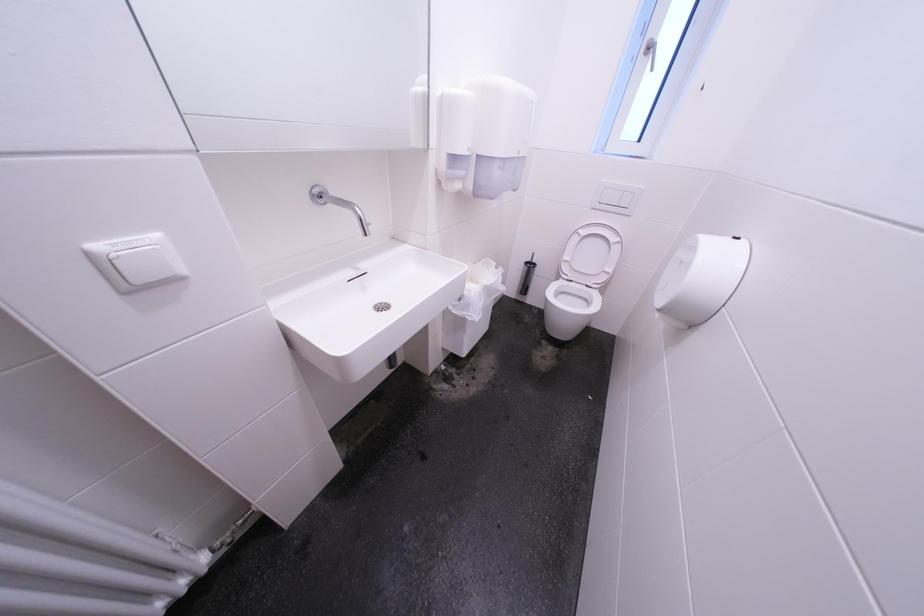
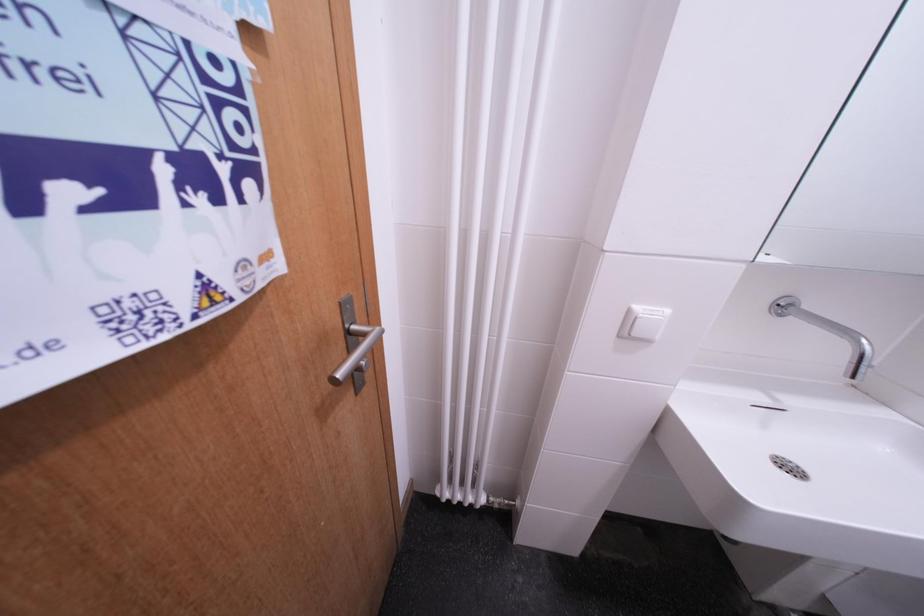
Question: The camera is either moving clockwise (left) or counter-clockwise (right) around the object. The first image is from the beginning of the video and the second image is from the end. Is the camera moving left or right when shooting the video?

Choices:
 (A) Left
 (B) Right

Answer: (B)